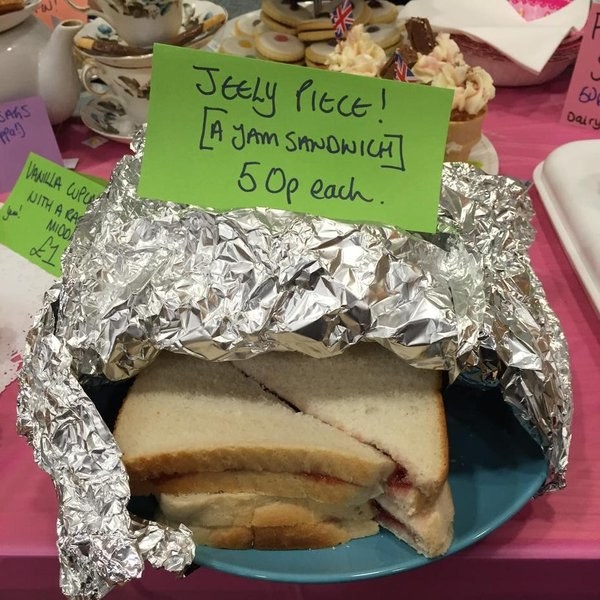
Locate an element on the screen. This screenshot has width=600, height=600. pink table cloth is located at coordinates [25, 475], [576, 496], [520, 142].